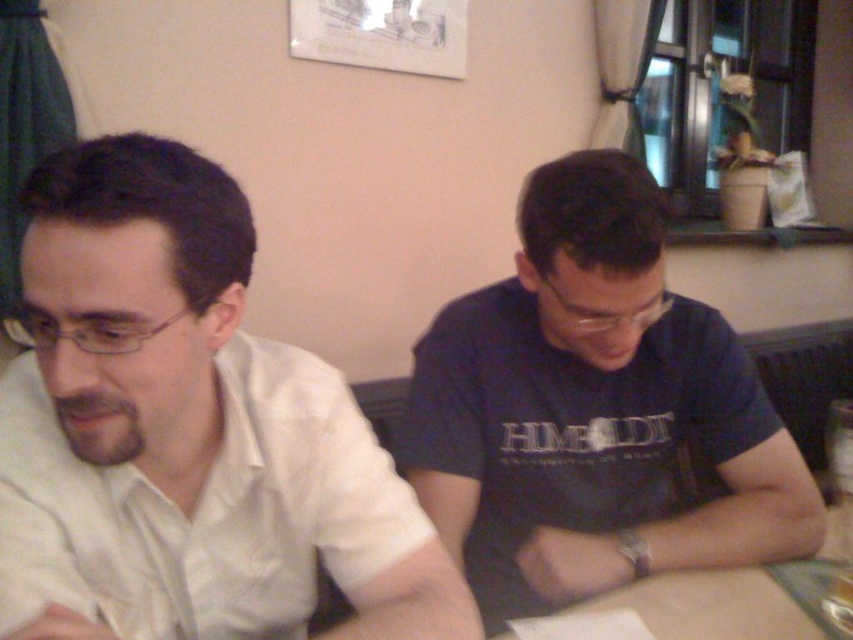
You are standing in front of the table and want to place a small object at the point with coordinates point [186,433]. According to the image, where should you place it?

The point [186,433] is on white satin shirt at left, so you should place the object on the white satin shirt at left.

You are standing in front of the table where the two people are sitting. You want to place a small object on the table. Which of the two points, point (0,628) or point (503,289), is closer to you?

Point (0,628) is closer to the viewer than point (503,289), so you should place the object there if you want it closer to you.

You are standing in the room and want to hand a document to the person wearing the white satin shirt at left. Based on their position, where should you approach them from?

The white satin shirt at left is located at point (186, 433), so you should approach them from the left side to ensure they can easily receive the document.